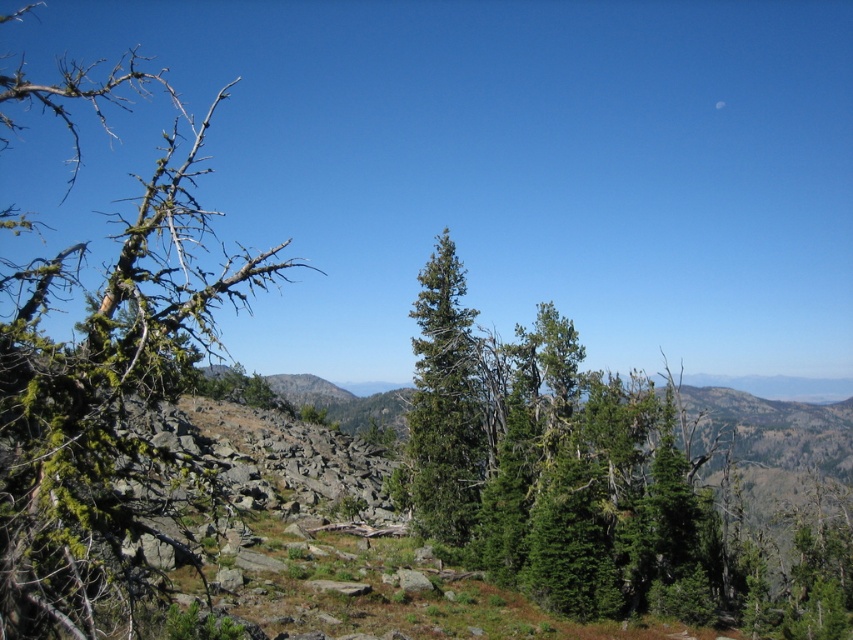
Question: Which of these objects is positioned farthest from the green matte evergreen tree at center?

Choices:
 (A) green mossy branch at left
 (B) green matte tree at center

Answer: (A)

Question: Is the position of green matte evergreen tree at center less distant than that of green matte tree at center?

Choices:
 (A) yes
 (B) no

Answer: (A)

Question: Among these points, which one is farthest from the camera?

Choices:
 (A) (689, 428)
 (B) (462, 410)
 (C) (93, 522)

Answer: (A)

Question: Is green matte evergreen tree at center closer to the viewer compared to green mossy branch at left?

Choices:
 (A) yes
 (B) no

Answer: (B)

Question: Is green matte evergreen tree at center wider than green mossy branch at left?

Choices:
 (A) yes
 (B) no

Answer: (B)

Question: Which point is farther to the camera?

Choices:
 (A) (596, 586)
 (B) (16, 566)
 (C) (415, 376)

Answer: (C)